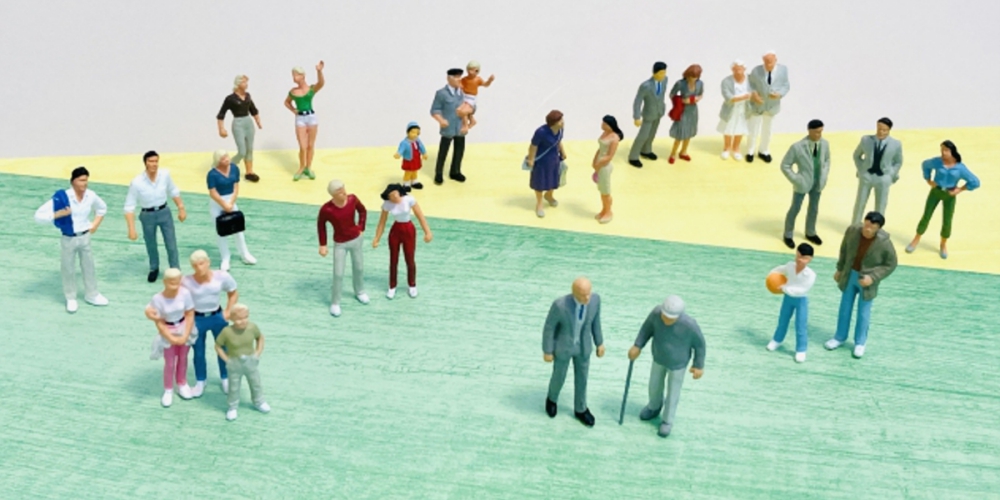
The width and height of the screenshot is (1000, 500). What are the coordinates of `figurines of women` in the screenshot? It's located at (172, 309), (230, 186), (396, 223), (299, 114), (238, 117), (595, 162), (539, 157), (683, 111), (740, 104), (943, 177).